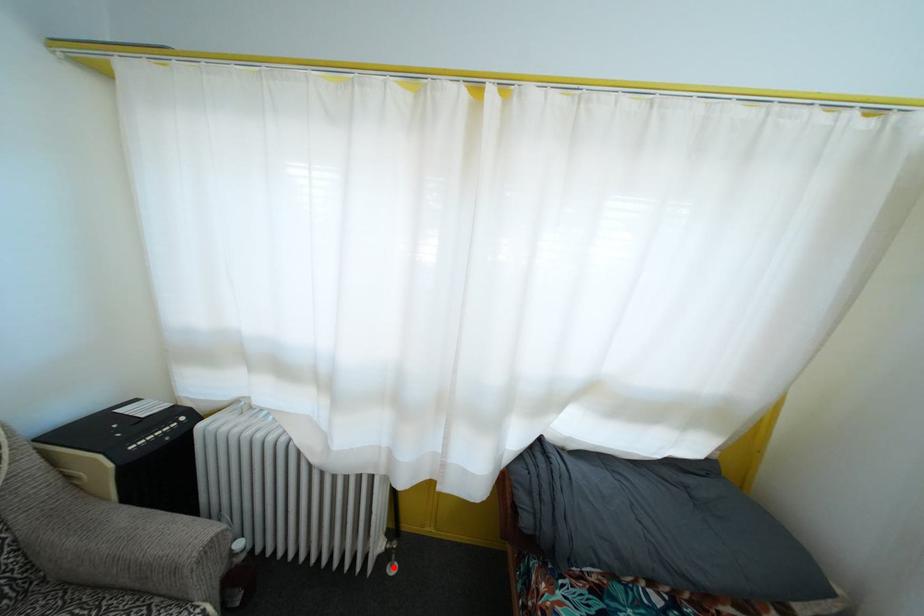
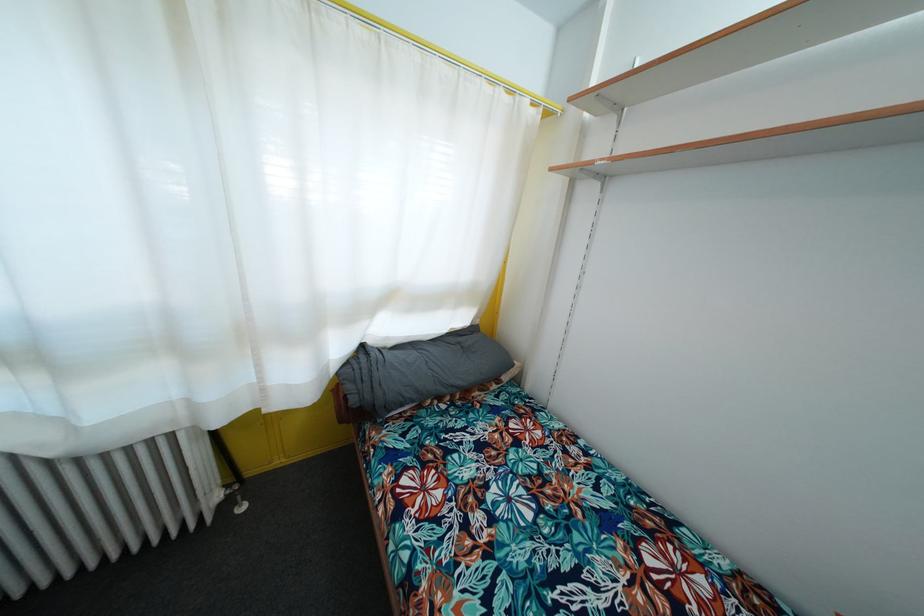
Locate, in the second image, the point that corresponds to the highlighted location in the first image.

(240, 511)